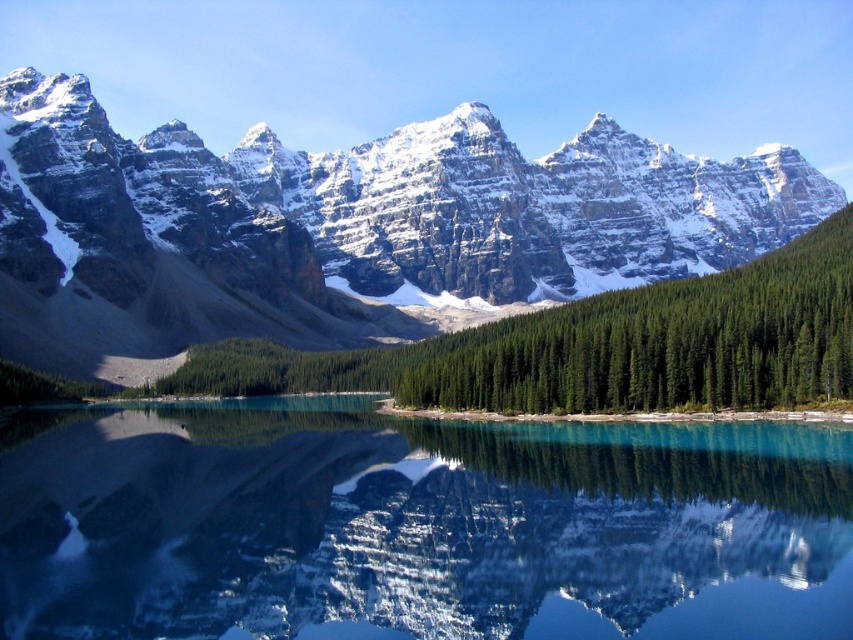
You are standing at the edge of the lake and see the clear glass water at center and the green matte forest at center. Which object is positioned to the left when facing the lake?

The clear glass water at center is to the left of the green matte forest at center.

You are standing on the lakeshore and see the clear glass water at center and the snowy rock mountain range at upper center. Which object is closer to your current position?

The clear glass water at center is closer to your current position because it is located below the snowy rock mountain range at upper center, which is further away.

You are standing at the edge of the lake and want to compare the height of the clear glass water at center and the snowy rock mountain range at upper center. Which one appears taller in the image?

The snowy rock mountain range at upper center appears taller than the clear glass water at center in the image.